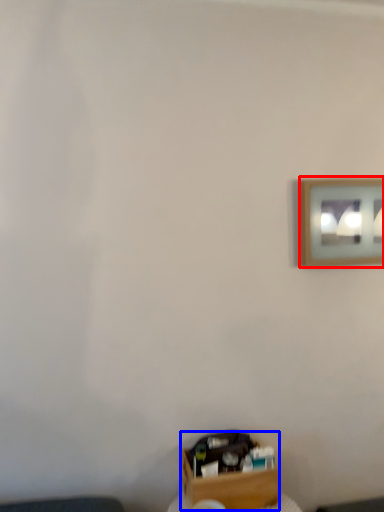
Question: Which point is closer to the camera, picture frame (highlighted by a red box) or box (highlighted by a blue box)?

Choices:
 (A) picture frame
 (B) box

Answer: (B)